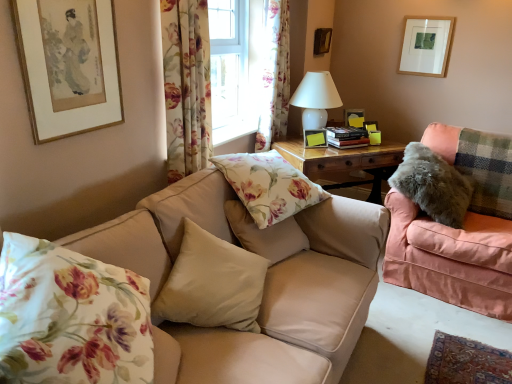
Image resolution: width=512 pixels, height=384 pixels. Describe the element at coordinates (316, 99) in the screenshot. I see `white glossy table lamp at upper center` at that location.

Describe the element at coordinates (265, 234) in the screenshot. This screenshot has width=512, height=384. I see `floral fabric cushion at center, which is counted as the third pillow, starting from the left` at that location.

This screenshot has width=512, height=384. Describe the element at coordinates (433, 185) in the screenshot. I see `fuzzy gray pillow at right, which appears as the first pillow when viewed from the right` at that location.

The image size is (512, 384). Describe the element at coordinates (268, 185) in the screenshot. I see `floral fabric pillow at center, the second pillow positioned from the right` at that location.

The height and width of the screenshot is (384, 512). Describe the element at coordinates (315, 138) in the screenshot. I see `matte black picture frame at center, the 2th picture frame in the left-to-right sequence` at that location.

I want to click on floral fabric curtain at upper center, placed as the first curtain when sorted from right to left, so click(275, 76).

The width and height of the screenshot is (512, 384). Describe the element at coordinates (71, 317) in the screenshot. I see `floral fabric pillow at lower left, the 1th pillow from the left` at that location.

Image resolution: width=512 pixels, height=384 pixels. Identify the location of white glossy table lamp at upper center. (316, 99).

From the image's perspective, relative to floral fabric pillow at center, which is the fourth pillow from left to right, is matte white picture frame at upper right, positioned as the 2th picture frame in back-to-front order, above or below?

matte white picture frame at upper right, positioned as the 2th picture frame in back-to-front order, is situated higher than floral fabric pillow at center, which is the fourth pillow from left to right, in the image.

From a real-world perspective, is matte white picture frame at upper right, placed as the fourth picture frame when sorted from left to right, beneath floral fabric pillow at center, which is the fourth pillow from left to right?

No, from a real-world perspective, matte white picture frame at upper right, placed as the fourth picture frame when sorted from left to right, is not under floral fabric pillow at center, which is the fourth pillow from left to right.

From the picture: Could you tell me if matte white picture frame at upper right, positioned as the 2th picture frame in back-to-front order, is facing floral fabric pillow at center, which is the fourth pillow from left to right?

Yes, matte white picture frame at upper right, positioned as the 2th picture frame in back-to-front order, is oriented towards floral fabric pillow at center, which is the fourth pillow from left to right.

Does matte white picture frame at upper right, placed as the fourth picture frame when sorted from left to right, have a greater width compared to floral fabric pillow at center, which is the fourth pillow from left to right?

No.

Considering the positions of objects floral fabric pillow at center, which is the fourth pillow from left to right, and floral fabric curtain at upper center, placed as the first curtain when sorted from right to left, in the image provided, who is behind, floral fabric pillow at center, which is the fourth pillow from left to right, or floral fabric curtain at upper center, placed as the first curtain when sorted from right to left,?

floral fabric curtain at upper center, placed as the first curtain when sorted from right to left.

From a real-world perspective, which pillow is the 1st one underneath the floral fabric curtain at upper center, which is the second curtain in front-to-back order? Please provide its 2D coordinates.

[(268, 185)]

How far apart are floral fabric pillow at center, the second pillow positioned from the right, and floral fabric curtain at upper center, which is the second curtain in front-to-back order?

floral fabric pillow at center, the second pillow positioned from the right, is 39.11 inches away from floral fabric curtain at upper center, which is the second curtain in front-to-back order.

How different are the orientations of floral fabric pillow at center, the second pillow positioned from the right, and floral fabric curtain at upper center, positioned as the second curtain in left-to-right order, in degrees?

The angle between the facing direction of floral fabric pillow at center, the second pillow positioned from the right, and the facing direction of floral fabric curtain at upper center, positioned as the second curtain in left-to-right order, is 20.9 degrees.

From the image's perspective, which one is positioned higher, fluffy pink couch at right, which is the 1th studio couch in right-to-left order, or floral fabric pillow at center, the second pillow positioned from the right?

floral fabric pillow at center, the second pillow positioned from the right, appears higher in the image.

Is fluffy pink couch at right, which is the 1th studio couch in right-to-left order, positioned behind floral fabric pillow at center, the second pillow positioned from the right?

Yes, fluffy pink couch at right, which is the 1th studio couch in right-to-left order, is further from the camera.

Is floral fabric pillow at center, which is the fourth pillow from left to right, surrounded by fluffy pink couch at right, marked as the second studio couch in a left-to-right arrangement?

Actually, floral fabric pillow at center, which is the fourth pillow from left to right, is outside fluffy pink couch at right, marked as the second studio couch in a left-to-right arrangement.

Is matte black picture frame at center, which ranks as the third picture frame in right-to-left order, far from floral fabric curtain at upper center, which ranks as the first curtain in front-to-back order?

matte black picture frame at center, which ranks as the third picture frame in right-to-left order, is far away from floral fabric curtain at upper center, which ranks as the first curtain in front-to-back order.

From the image's perspective, which one is positioned higher, matte black picture frame at center, which ranks as the third picture frame in right-to-left order, or floral fabric curtain at upper center, placed as the first curtain when sorted from left to right?

floral fabric curtain at upper center, placed as the first curtain when sorted from left to right, appears higher in the image.

From their relative heights in the image, would you say matte black picture frame at center, which ranks as the third picture frame in right-to-left order, is taller or shorter than floral fabric curtain at upper center, which ranks as the 2th curtain in back-to-front order?

In the image, matte black picture frame at center, which ranks as the third picture frame in right-to-left order, appears to be shorter than floral fabric curtain at upper center, which ranks as the 2th curtain in back-to-front order.

Is matte black picture frame at center, which ranks as the third picture frame in right-to-left order, placed right next to floral fabric curtain at upper center, the first curtain when ordered from back to front?

No.

Considering the positions of objects matte black picture frame at center, acting as the second picture frame starting from the front, and floral fabric curtain at upper center, positioned as the second curtain in left-to-right order, in the image provided, who is more to the left, matte black picture frame at center, acting as the second picture frame starting from the front, or floral fabric curtain at upper center, positioned as the second curtain in left-to-right order,?

From the viewer's perspective, floral fabric curtain at upper center, positioned as the second curtain in left-to-right order, appears more on the left side.

In the scene shown: Does matte black picture frame at center, acting as the second picture frame starting from the front, have a greater width compared to floral fabric curtain at upper center, the first curtain when ordered from back to front?

In fact, matte black picture frame at center, acting as the second picture frame starting from the front, might be narrower than floral fabric curtain at upper center, the first curtain when ordered from back to front.

What's the angular difference between matte black picture frame at center, the third picture frame when ordered from back to front, and floral fabric curtain at upper center, placed as the first curtain when sorted from right to left,'s facing directions?

The angle between the facing direction of matte black picture frame at center, the third picture frame when ordered from back to front, and the facing direction of floral fabric curtain at upper center, placed as the first curtain when sorted from right to left, is 44.5 degrees.

Is beige fabric pillow at center, positioned as the 2th pillow in left-to-right order, facing towards floral fabric curtain at upper center, which ranks as the 2th curtain in back-to-front order?

No.

From a real-world perspective, who is located lower, beige fabric pillow at center, positioned as the 2th pillow in left-to-right order, or floral fabric curtain at upper center, which ranks as the 2th curtain in back-to-front order?

beige fabric pillow at center, positioned as the 2th pillow in left-to-right order, from a real-world perspective.

Is beige fabric pillow at center, positioned as the 2th pillow in left-to-right order, wider than floral fabric curtain at upper center, placed as the first curtain when sorted from left to right?

Yes, beige fabric pillow at center, positioned as the 2th pillow in left-to-right order, is wider than floral fabric curtain at upper center, placed as the first curtain when sorted from left to right.

Considering the relative sizes of white glossy table lamp at upper center and floral fabric curtain at upper center, positioned as the second curtain in left-to-right order, in the image provided, is white glossy table lamp at upper center shorter than floral fabric curtain at upper center, positioned as the second curtain in left-to-right order,?

Yes, white glossy table lamp at upper center is shorter than floral fabric curtain at upper center, positioned as the second curtain in left-to-right order.

In the scene shown: Can you confirm if white glossy table lamp at upper center is positioned to the right of floral fabric curtain at upper center, which is the second curtain in front-to-back order?

Indeed, white glossy table lamp at upper center is positioned on the right side of floral fabric curtain at upper center, which is the second curtain in front-to-back order.

From the image's perspective, which one is positioned lower, white glossy table lamp at upper center or floral fabric curtain at upper center, positioned as the second curtain in left-to-right order?

white glossy table lamp at upper center is shown below in the image.

Does white glossy table lamp at upper center turn towards floral fabric curtain at upper center, placed as the first curtain when sorted from right to left?

No, white glossy table lamp at upper center is not turned towards floral fabric curtain at upper center, placed as the first curtain when sorted from right to left.

The height and width of the screenshot is (384, 512). In order to click on the 2nd picture frame directly above the floral fabric pillow at center, the second pillow positioned from the right (from a real-world perspective) in this screenshot , I will do `click(426, 45)`.

This screenshot has width=512, height=384. I want to click on pillow that is the 2nd object located in front of the floral fabric curtain at upper center, positioned as the second curtain in left-to-right order, so click(x=268, y=185).

From the image, which object appears to be farther from floral fabric pillow at lower left, the 1th pillow from the left, fluffy pink couch at right, which is the 1th studio couch in right-to-left order, or beige fabric pillow at center, the fourth pillow in the right-to-left sequence?

fluffy pink couch at right, which is the 1th studio couch in right-to-left order, lies further to floral fabric pillow at lower left, the 1th pillow from the left, than the other object.

When comparing their distances from floral fabric pillow at center, which is the fourth pillow from left to right, does wooden picture frame at upper center, the fourth picture frame in the front-to-back sequence, or fluffy pink couch at right, which is the 1th studio couch in right-to-left order, seem closer?

fluffy pink couch at right, which is the 1th studio couch in right-to-left order, lies closer to floral fabric pillow at center, which is the fourth pillow from left to right, than the other object.

When comparing their distances from matte black picture frame at center, the 2th picture frame in the left-to-right sequence, does matte gold picture frame at upper left, the first picture frame when ordered from front to back, or floral fabric pillow at center, the second pillow positioned from the right, seem further?

The object further to matte black picture frame at center, the 2th picture frame in the left-to-right sequence, is matte gold picture frame at upper left, the first picture frame when ordered from front to back.

Based on the photo, based on their spatial positions, is beige fabric pillow at center, positioned as the 2th pillow in left-to-right order, or floral fabric cushion at center, which is counted as the third pillow, starting from the left, closer to floral fabric curtain at upper center, the first curtain when ordered from back to front?

floral fabric cushion at center, which is counted as the third pillow, starting from the left, is closer to floral fabric curtain at upper center, the first curtain when ordered from back to front.

Estimate the real-world distances between objects in this image. Which object is closer to fuzzy gray pillow at right, the fifth pillow from the left, matte gold picture frame at upper left, which is the 4th picture frame in back-to-front order, or floral fabric curtain at upper center, positioned as the second curtain in left-to-right order?

floral fabric curtain at upper center, positioned as the second curtain in left-to-right order.

From the picture: From the image, which object appears to be nearer to floral fabric pillow at lower left, the 1th pillow from the left, fuzzy gray pillow at right, the fifth pillow from the left, or matte black picture frame at center, acting as the second picture frame starting from the front?

fuzzy gray pillow at right, the fifth pillow from the left, is closer to floral fabric pillow at lower left, the 1th pillow from the left.

Which object lies further to the anchor point beige fabric pillow at center, positioned as the 2th pillow in left-to-right order, white glossy table lamp at upper center or floral fabric curtain at upper center, the 2th curtain from the right?

white glossy table lamp at upper center is positioned further to the anchor beige fabric pillow at center, positioned as the 2th pillow in left-to-right order.

Based on their spatial positions, is matte gold picture frame at upper left, which is the 4th picture frame from right to left, or matte white picture frame at upper right, positioned as the 2th picture frame in back-to-front order, further from floral fabric curtain at upper center, placed as the first curtain when sorted from right to left?

matte gold picture frame at upper left, which is the 4th picture frame from right to left.

Where is `studio couch situated between matte gold picture frame at upper left, which is the 4th picture frame in back-to-front order, and fluffy pink couch at right, which is the 1th studio couch in right-to-left order, from left to right`? The image size is (512, 384). studio couch situated between matte gold picture frame at upper left, which is the 4th picture frame in back-to-front order, and fluffy pink couch at right, which is the 1th studio couch in right-to-left order, from left to right is located at coordinates (265, 279).

Where is `studio couch between beige fabric couch at center, which is the second studio couch from right to left, and fuzzy gray pillow at right, which appears as the first pillow when viewed from the right, from front to back`? The width and height of the screenshot is (512, 384). studio couch between beige fabric couch at center, which is the second studio couch from right to left, and fuzzy gray pillow at right, which appears as the first pillow when viewed from the right, from front to back is located at coordinates (451, 258).

Find the location of a particular element. The image size is (512, 384). table lamp between floral fabric cushion at center, which is counted as the third pillow, starting from the left, and fluffy pink couch at right, which is the 1th studio couch in right-to-left order, in the horizontal direction is located at coordinates (316, 99).

Image resolution: width=512 pixels, height=384 pixels. What are the coordinates of `studio couch between beige fabric pillow at center, the fourth pillow in the right-to-left sequence, and wooden picture frame at upper center, the fourth picture frame in the front-to-back sequence, along the z-axis` in the screenshot? It's located at (451, 258).